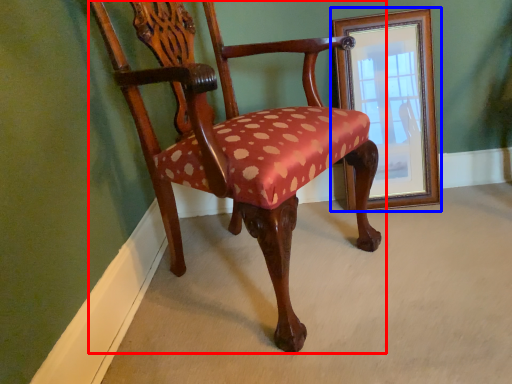
Question: Among these objects, which one is nearest to the camera, chair (highlighted by a red box) or picture frame (highlighted by a blue box)?

Choices:
 (A) chair
 (B) picture frame

Answer: (A)